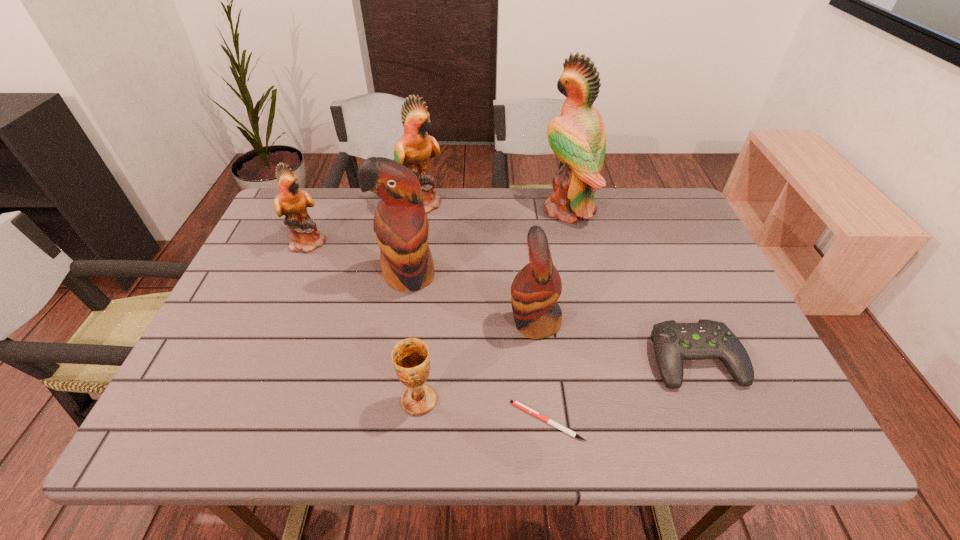
Identify which green parrot is the nearest to the second biggest green parrot. Please provide its 2D coordinates. Your answer should be formatted as a tuple, i.e. [(x, y)], where the tuple contains the x and y coordinates of a point satisfying the conditions above.

[(292, 202)]

Find the location of a particular element. Image resolution: width=960 pixels, height=540 pixels. blank space that satisfies the following two spatial constraints: 1. on the back side of the control; 2. on the front-facing side of the second green parrot from right to left is located at coordinates pos(631,203).

Locate an element on the screen. Image resolution: width=960 pixels, height=540 pixels. free space that satisfies the following two spatial constraints: 1. on the front-facing side of the leftmost green parrot; 2. on the right side of the chalice is located at coordinates (243, 400).

At what (x,y) coordinates should I click in order to perform the action: click on free region that satisfies the following two spatial constraints: 1. on the front-facing side of the leftmost object; 2. on the left side of the seventh tallest object. Please return your answer as a coordinate pair (x, y). Looking at the image, I should click on (260, 359).

Find the location of `vacant space that satisfies the following two spatial constraints: 1. on the back side of the rightmost object; 2. on the face of the smaller red parrot`. vacant space that satisfies the following two spatial constraints: 1. on the back side of the rightmost object; 2. on the face of the smaller red parrot is located at coordinates (680, 322).

At what (x,y) coordinates should I click in order to perform the action: click on free space in the image that satisfies the following two spatial constraints: 1. on the back side of the chalice; 2. on the front-facing side of the second smallest green parrot. Please return your answer as a coordinate pair (x, y). This screenshot has height=540, width=960. Looking at the image, I should click on (441, 203).